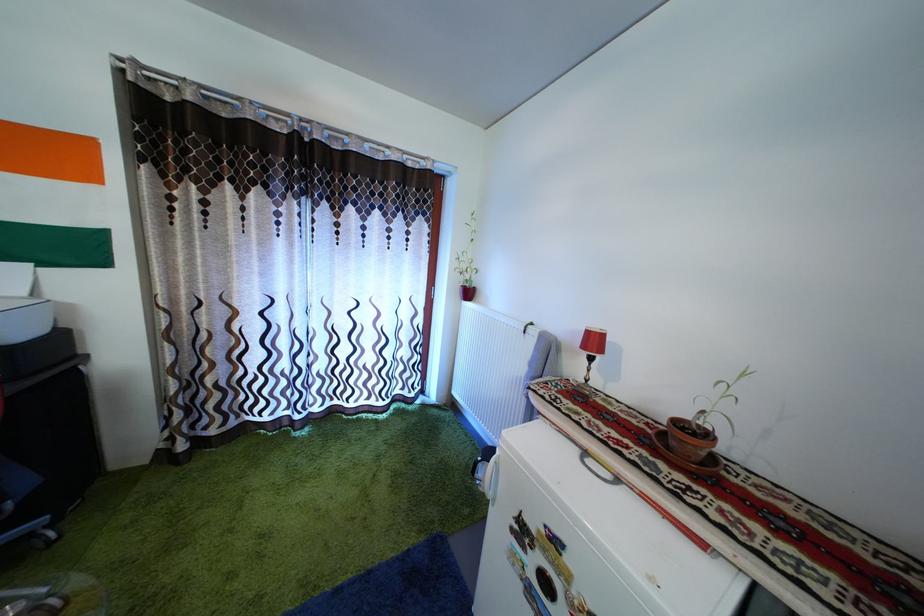
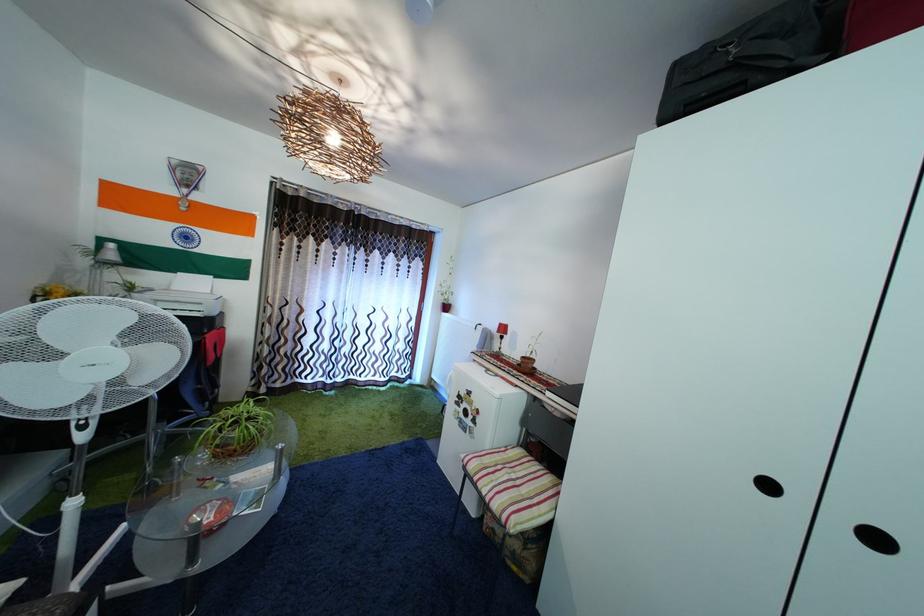
Question: The images are taken continuously from a first-person perspective. In which direction are you moving?

Choices:
 (A) Left
 (B) Right
 (C) Forward
 (D) Backward

Answer: (D)